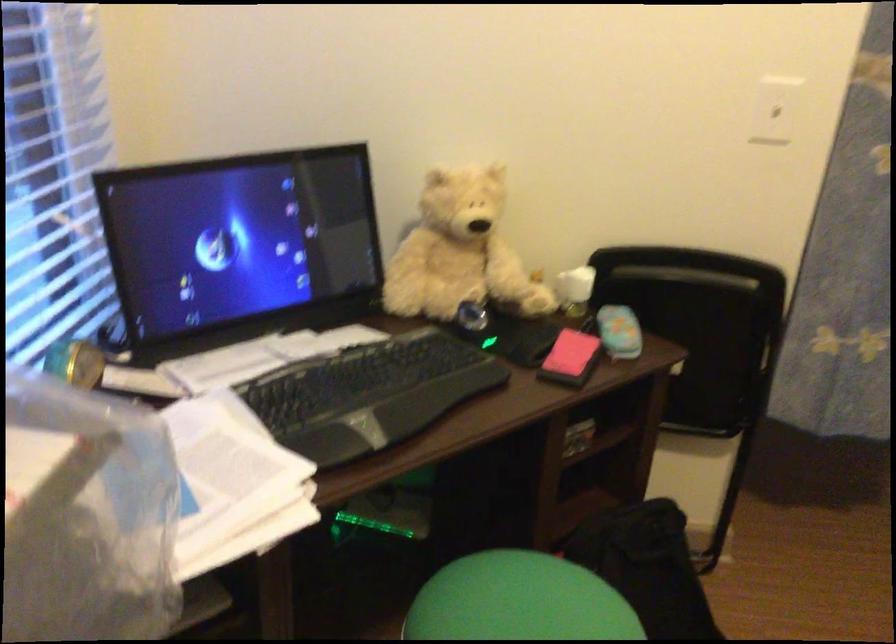
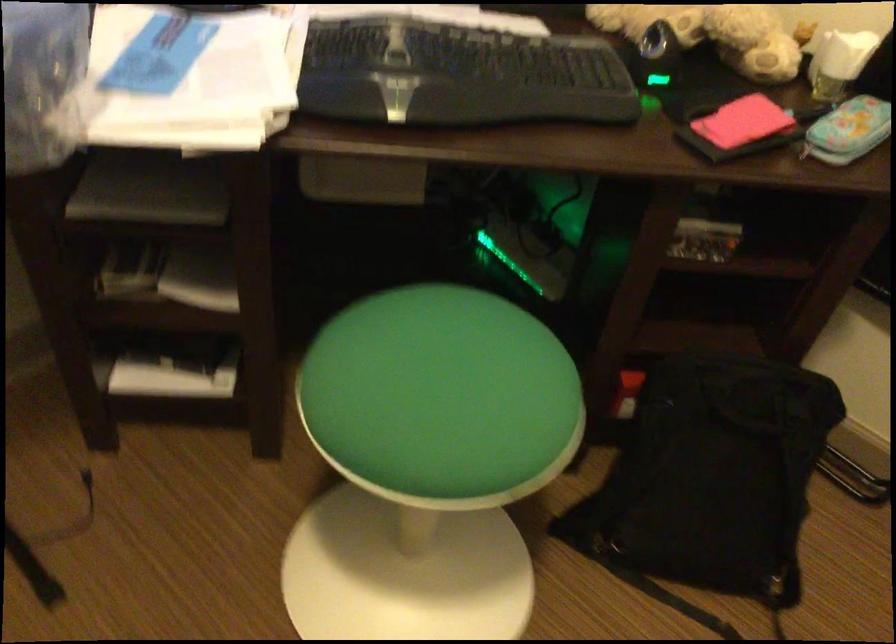
Where in the second image is the point corresponding to point 634,333 from the first image?

(848, 129)